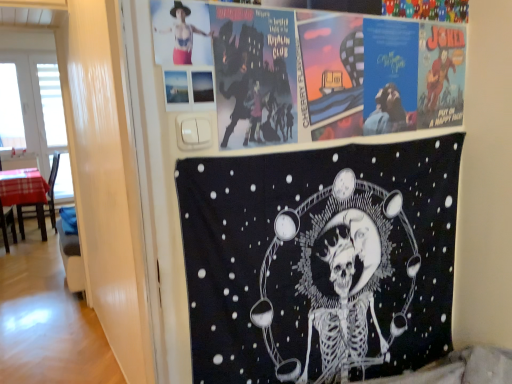
Question: Should I look upward or downward to see plaid fabric chair at left?

Choices:
 (A) up
 (B) down

Answer: (B)

Question: Should I look upward or downward to see matte black and pink fabric at upper left?

Choices:
 (A) down
 (B) up

Answer: (B)

Question: From a real-world perspective, is matte black and pink fabric at upper left below white plastic window screen at left?

Choices:
 (A) no
 (B) yes

Answer: (A)

Question: From the image's perspective, is matte black and pink fabric at upper left under white plastic window screen at left?

Choices:
 (A) yes
 (B) no

Answer: (A)

Question: Can we say matte black and pink fabric at upper left lies outside white plastic window screen at left?

Choices:
 (A) no
 (B) yes

Answer: (B)

Question: From the image's perspective, is matte black and pink fabric at upper left over white plastic window screen at left?

Choices:
 (A) yes
 (B) no

Answer: (B)

Question: Does matte black and pink fabric at upper left contain white plastic window screen at left?

Choices:
 (A) no
 (B) yes

Answer: (A)

Question: Does matte black and pink fabric at upper left have a lesser height compared to white plastic window screen at left?

Choices:
 (A) no
 (B) yes

Answer: (B)

Question: Is black fabric poster at upper center, the second poster from the top, to the right of matte paper poster at upper center, positioned as the first poster in top-to-bottom order, from the viewer's perspective?

Choices:
 (A) no
 (B) yes

Answer: (A)

Question: Is black fabric poster at upper center, which ranks as the first poster in bottom-to-top order, thinner than matte paper poster at upper center, positioned as the first poster in top-to-bottom order?

Choices:
 (A) no
 (B) yes

Answer: (A)

Question: Is matte paper poster at upper center, the second poster when ordered from bottom to top, completely or partially inside black fabric poster at upper center, which ranks as the first poster in bottom-to-top order?

Choices:
 (A) no
 (B) yes

Answer: (A)

Question: Can you confirm if black fabric poster at upper center, the second poster from the top, is wider than matte paper poster at upper center, the second poster when ordered from bottom to top?

Choices:
 (A) yes
 (B) no

Answer: (A)

Question: Is black fabric poster at upper center, which ranks as the first poster in bottom-to-top order, aimed at matte paper poster at upper center, positioned as the first poster in top-to-bottom order?

Choices:
 (A) yes
 (B) no

Answer: (B)

Question: Can you confirm if black fabric poster at upper center, which ranks as the first poster in bottom-to-top order, is shorter than matte paper poster at upper center, positioned as the first poster in top-to-bottom order?

Choices:
 (A) no
 (B) yes

Answer: (A)

Question: Does plaid fabric chair at left have a greater width compared to matte black and pink fabric at upper left?

Choices:
 (A) yes
 (B) no

Answer: (A)